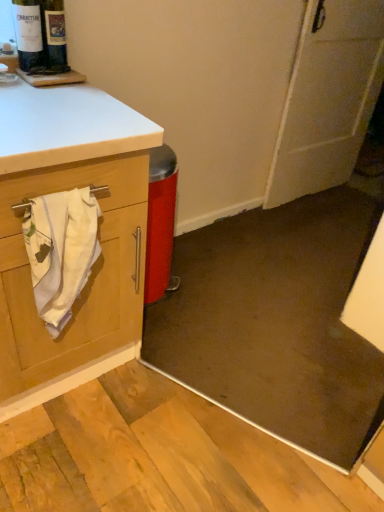
This screenshot has width=384, height=512. I want to click on matte glass bottle at upper left, so 40,35.

What do you see at coordinates (40, 35) in the screenshot? I see `matte glass bottle at upper left` at bounding box center [40, 35].

Where is `white cotton towel at left`? white cotton towel at left is located at coordinates (61, 251).

Based on the photo, is white matte door at upper right a part of matte glass wine bottle at upper left?

No, matte glass wine bottle at upper left does not contain white matte door at upper right.

Visually, is matte glass wine bottle at upper left positioned to the left or to the right of white matte door at upper right?

In the image, matte glass wine bottle at upper left appears on the left side of white matte door at upper right.

Which object is thinner, matte glass wine bottle at upper left or white matte door at upper right?

matte glass wine bottle at upper left.

From a real-world perspective, which object stands above the other?

matte glass wine bottle at upper left is physically above.

Is point (59, 246) positioned after point (32, 68)?

No, it is in front of (32, 68).

Would you say white cotton towel at left contains matte glass bottle at upper left?

No, white cotton towel at left does not contain matte glass bottle at upper left.

In the scene shown: Is matte glass bottle at upper left at the back of white cotton towel at left?

No.

Relative to matte glass bottle at upper left, is white cotton towel at left in front or behind?

white cotton towel at left is in front of matte glass bottle at upper left.

From the image's perspective, which object appears higher, white matte door at upper right or matte glass bottle at upper left?

From the image's view, white matte door at upper right is above.

Is point (322, 69) farther from viewer compared to point (40, 33)?

Yes, it is behind point (40, 33).

Considering the positions of objects white matte door at upper right and matte glass bottle at upper left in the image provided, who is behind, white matte door at upper right or matte glass bottle at upper left?

white matte door at upper right is behind.

Is white matte door at upper right at the left side of matte glass bottle at upper left?

No, white matte door at upper right is not to the left of matte glass bottle at upper left.

Which is nearer, [70,267] or [44,18]?

Point [70,267].

From a real-world perspective, is white cotton towel at left above or below matte glass wine bottle at upper left?

In terms of real-world spatial position, white cotton towel at left is below matte glass wine bottle at upper left.

Considering the relative sizes of white cotton towel at left and matte glass wine bottle at upper left in the image provided, is white cotton towel at left shorter than matte glass wine bottle at upper left?

Incorrect, the height of white cotton towel at left does not fall short of that of matte glass wine bottle at upper left.

Is point (363, 41) closer to camera compared to point (55, 6)?

That is False.

Is white matte door at upper right facing away from matte glass wine bottle at upper left?

That's not correct — white matte door at upper right is not looking away from matte glass wine bottle at upper left.

From the image's perspective, would you say white matte door at upper right is positioned over matte glass wine bottle at upper left?

Correct, white matte door at upper right appears higher than matte glass wine bottle at upper left in the image.

In the image, is white matte door at upper right on the left side or the right side of matte glass wine bottle at upper left?

In the image, white matte door at upper right appears on the right side of matte glass wine bottle at upper left.

From a real-world perspective, does matte glass bottle at upper left stand above white matte door at upper right?

Yes.

Who is bigger, matte glass bottle at upper left or white matte door at upper right?

Bigger between the two is white matte door at upper right.

From the picture: Considering the relative sizes of matte glass bottle at upper left and white matte door at upper right in the image provided, is matte glass bottle at upper left taller than white matte door at upper right?

No, matte glass bottle at upper left is not taller than white matte door at upper right.

Is matte glass bottle at upper left inside or outside of white matte door at upper right?

matte glass bottle at upper left is not inside white matte door at upper right, it's outside.

Is white cotton towel at left shorter than white matte door at upper right?

Yes, white cotton towel at left is shorter than white matte door at upper right.

Can you confirm if white cotton towel at left is thinner than white matte door at upper right?

Yes, white cotton towel at left is thinner than white matte door at upper right.

Is white cotton towel at left inside the boundaries of white matte door at upper right, or outside?

white cotton towel at left is not inside white matte door at upper right, it's outside.

Can you tell me how much white cotton towel at left and white matte door at upper right differ in facing direction?

The facing directions of white cotton towel at left and white matte door at upper right are 1.97 degrees apart.

Find the location of a particular element. door behind the matte glass wine bottle at upper left is located at coordinates (328, 98).

I want to click on beer bottle above the white cotton towel at left (from the image's perspective), so click(40, 35).

Based on their spatial positions, is white cotton towel at left or matte glass bottle at upper left closer to white matte door at upper right?

The object closer to white matte door at upper right is matte glass bottle at upper left.

Based on their spatial positions, is white cotton towel at left or matte glass wine bottle at upper left closer to white matte door at upper right?

matte glass wine bottle at upper left lies closer to white matte door at upper right than the other object.

Which object lies further to the anchor point matte glass wine bottle at upper left, white matte door at upper right or matte glass bottle at upper left?

Among the two, white matte door at upper right is located further to matte glass wine bottle at upper left.

When comparing their distances from white matte door at upper right, does matte glass wine bottle at upper left or white cotton towel at left seem further?

The object further to white matte door at upper right is white cotton towel at left.

Estimate the real-world distances between objects in this image. Which object is further from white matte door at upper right, matte glass bottle at upper left or matte glass wine bottle at upper left?

matte glass wine bottle at upper left is positioned further to the anchor white matte door at upper right.

Considering their positions, is matte glass bottle at upper left positioned further to white cotton towel at left than matte glass wine bottle at upper left?

Based on the image, matte glass wine bottle at upper left appears to be further to white cotton towel at left.

Estimate the real-world distances between objects in this image. Which object is further from white cotton towel at left, white matte door at upper right or matte glass bottle at upper left?

Among the two, white matte door at upper right is located further to white cotton towel at left.

From the image, which object appears to be farther from matte glass bottle at upper left, matte glass wine bottle at upper left or white matte door at upper right?

Based on the image, white matte door at upper right appears to be further to matte glass bottle at upper left.

You are a GUI agent. You are given a task and a screenshot of the screen. Output one action in this format:
    pyautogui.click(x=<x>, y=<y>)
    Task: Click on the bath towel situated between matte glass bottle at upper left and white matte door at upper right from left to right
    This screenshot has width=384, height=512.
    Given the screenshot: What is the action you would take?
    pyautogui.click(x=61, y=251)

Find the location of a particular element. The height and width of the screenshot is (512, 384). wine bottle between matte glass bottle at upper left and white matte door at upper right from left to right is located at coordinates (54, 36).

At what (x,y) coordinates should I click in order to perform the action: click on bath towel located between matte glass wine bottle at upper left and white matte door at upper right in the left-right direction. Please return your answer as a coordinate pair (x, y). This screenshot has width=384, height=512. Looking at the image, I should click on (61, 251).

The width and height of the screenshot is (384, 512). I want to click on beer bottle between matte glass wine bottle at upper left and white cotton towel at left from top to bottom, so click(x=40, y=35).